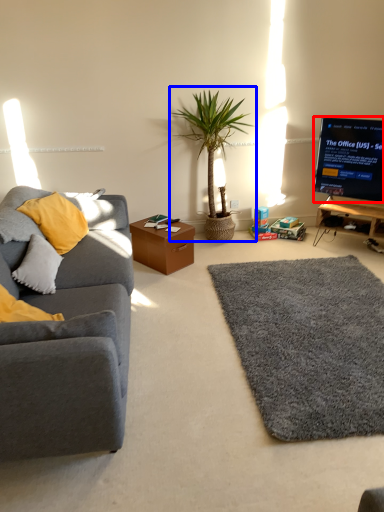
Question: Which point is closer to the camera, television (highlighted by a red box) or houseplant (highlighted by a blue box)?

Choices:
 (A) television
 (B) houseplant

Answer: (B)